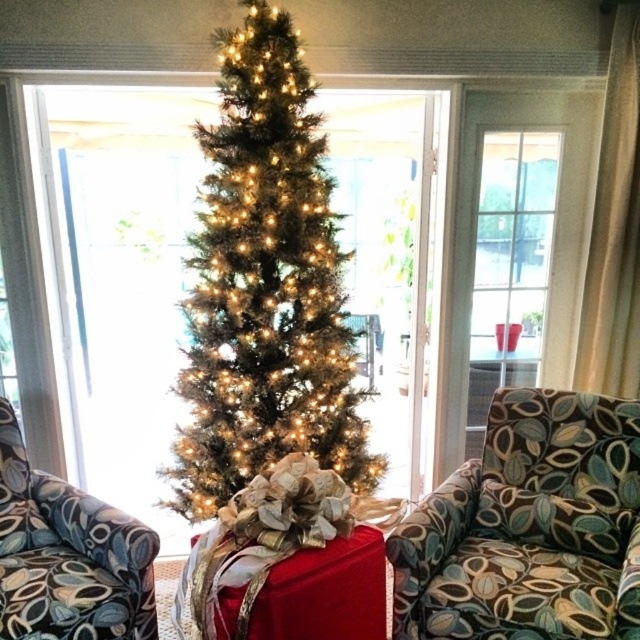
Question: Is the position of green textured christmas tree at center more distant than that of patterned fabric armchair at left?

Choices:
 (A) yes
 (B) no

Answer: (A)

Question: Which object is positioned farthest from the green textured christmas tree at center?

Choices:
 (A) patterned fabric armchair at center
 (B) patterned fabric armchair at left

Answer: (A)

Question: Does patterned fabric armchair at center have a larger size compared to patterned fabric armchair at left?

Choices:
 (A) no
 (B) yes

Answer: (B)

Question: Among these objects, which one is farthest from the camera?

Choices:
 (A) patterned fabric armchair at center
 (B) green textured christmas tree at center
 (C) patterned fabric armchair at left

Answer: (B)

Question: Which of the following is the closest to the observer?

Choices:
 (A) (428, 616)
 (B) (330, 406)
 (C) (88, 628)

Answer: (C)

Question: Can you confirm if green textured christmas tree at center is wider than patterned fabric armchair at left?

Choices:
 (A) yes
 (B) no

Answer: (A)